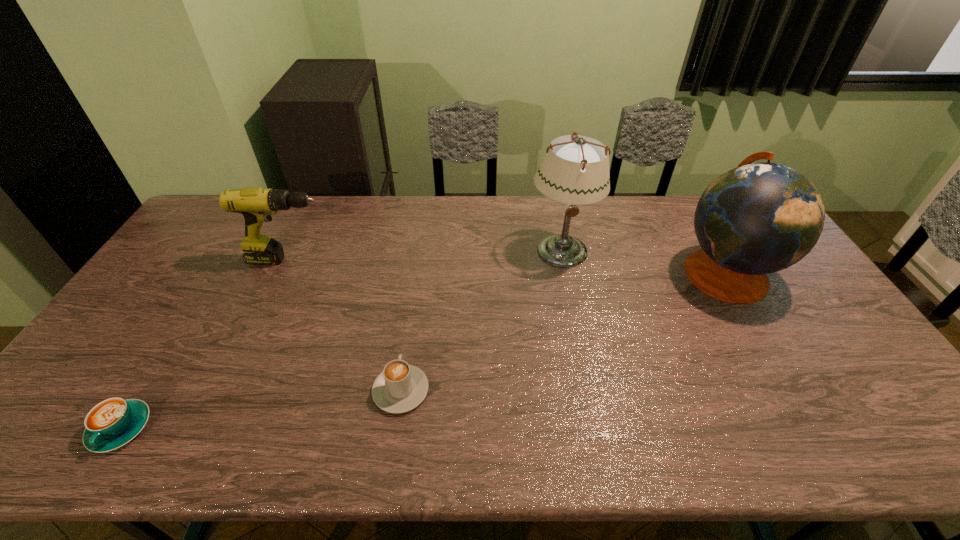
Where is `free space located 0.360m with the Americas facing the viewer on the rightmost object`? This screenshot has width=960, height=540. free space located 0.360m with the Americas facing the viewer on the rightmost object is located at coordinates (561, 272).

The height and width of the screenshot is (540, 960). I want to click on vacant region located 0.080m with the Americas facing the viewer on the rightmost object, so click(650, 272).

Where is `vacant space located 0.090m on the handle side of the drill`? The width and height of the screenshot is (960, 540). vacant space located 0.090m on the handle side of the drill is located at coordinates (359, 260).

Find the location of a particular element. This screenshot has width=960, height=540. free space located 0.110m to the right of the third object from left to right is located at coordinates click(x=409, y=333).

I want to click on free region located to the right of the third object from left to right, so click(412, 317).

Locate an element on the screen. The image size is (960, 540). vacant space situated to the right of the third object from left to right is located at coordinates (416, 289).

Locate an element on the screen. object that is at the far edge is located at coordinates (576, 172).

Identify the location of object that is at the near edge. The height and width of the screenshot is (540, 960). click(112, 423).

At what (x,y) coordinates should I click in order to perform the action: click on object at the left edge. Please return your answer as a coordinate pair (x, y). The height and width of the screenshot is (540, 960). Looking at the image, I should click on (112, 423).

The height and width of the screenshot is (540, 960). In order to click on object that is at the right edge in this screenshot , I will do `click(756, 219)`.